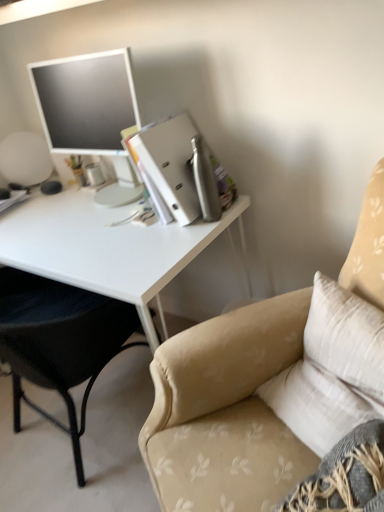
Locate an element on the screen. blank space above beige fabric chair at left, the first chair positioned from the left (from a real-world perspective) is located at coordinates (49, 246).